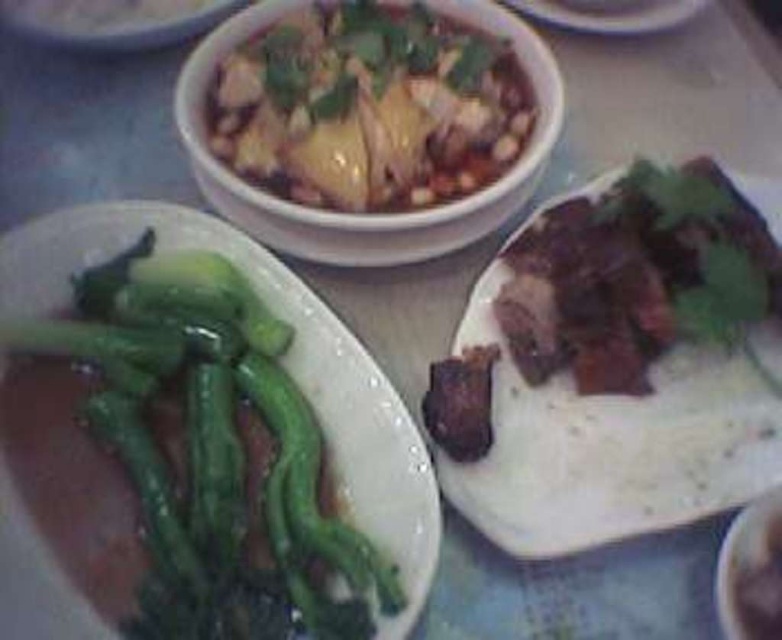
Question: Which of the following is the farthest from the observer?

Choices:
 (A) brown matte meat at right
 (B) brown crispy meat at center

Answer: (B)

Question: Does green glossy vegetables at left have a larger size compared to white glossy bowl at upper center?

Choices:
 (A) yes
 (B) no

Answer: (A)

Question: Is green glossy vegetables at left below brown crispy meat at center?

Choices:
 (A) yes
 (B) no

Answer: (A)

Question: Considering the real-world distances, which object is closest to the white ceramic plate at upper center?

Choices:
 (A) white glossy bowl at upper center
 (B) green glossy vegetables at left
 (C) brown matte meat at right

Answer: (C)

Question: Is white glossy chicken at upper center to the left of white glossy bowl at upper center from the viewer's perspective?

Choices:
 (A) yes
 (B) no

Answer: (B)

Question: Which of the following is the farthest from the observer?

Choices:
 (A) brown matte meat at right
 (B) brown crispy meat at center

Answer: (B)